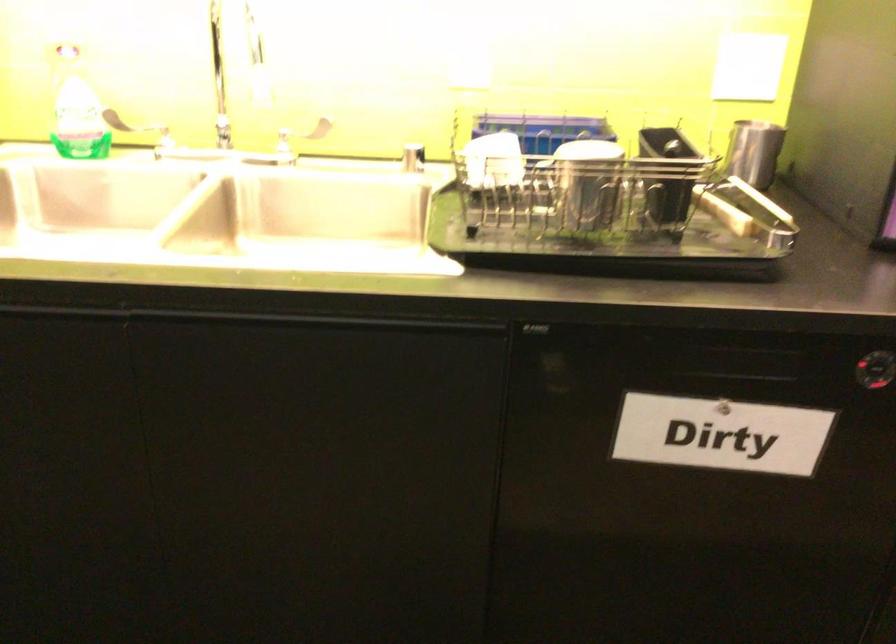
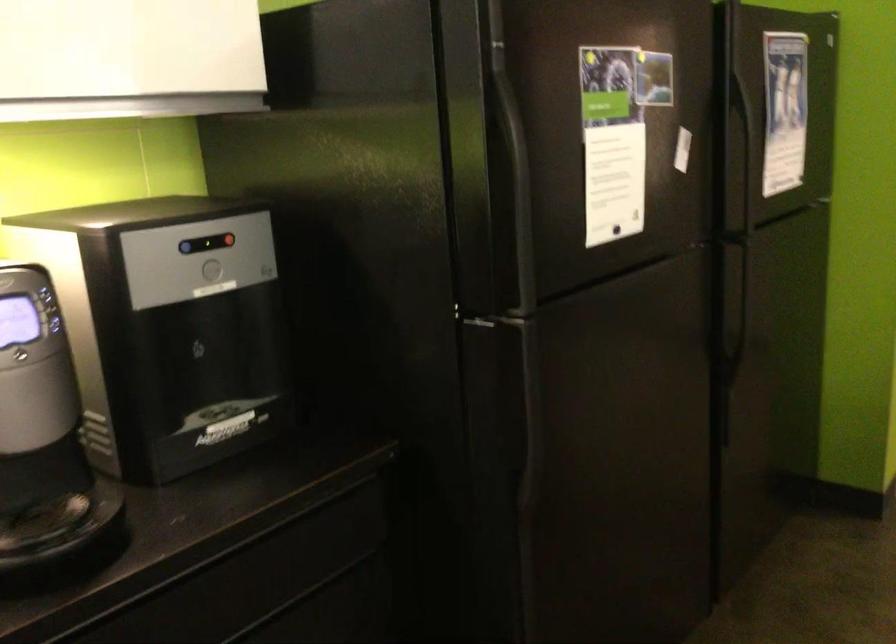
Question: The first image is from the beginning of the video and the second image is from the end. How did the camera likely rotate when shooting the video?

Choices:
 (A) Left
 (B) Right
 (C) Up
 (D) Down

Answer: (B)